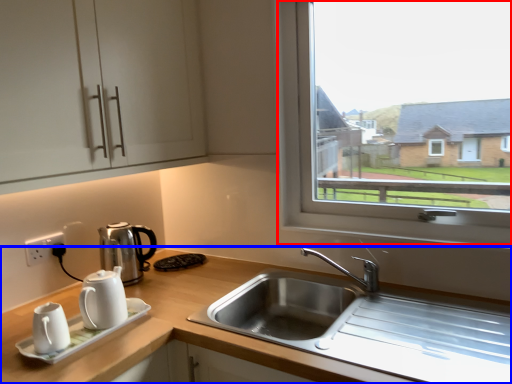
Question: Which object is further to the camera taking this photo, window (highlighted by a red box) or countertop (highlighted by a blue box)?

Choices:
 (A) window
 (B) countertop

Answer: (A)